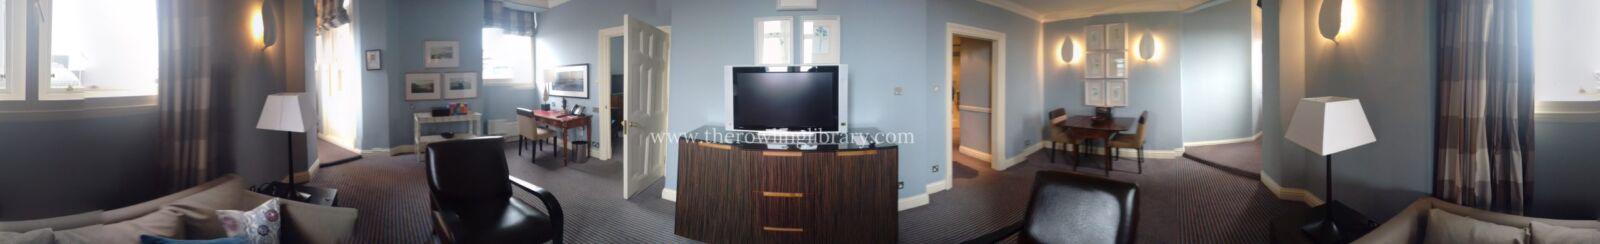
You are a GUI agent. You are given a task and a screenshot of the screen. Output one action in this format:
    pyautogui.click(x=<x>, y=<y>)
    Task: Click on the wall mounted light sconces
    
    Given the screenshot: What is the action you would take?
    pyautogui.click(x=1338, y=24), pyautogui.click(x=1146, y=50), pyautogui.click(x=1072, y=47), pyautogui.click(x=266, y=31)